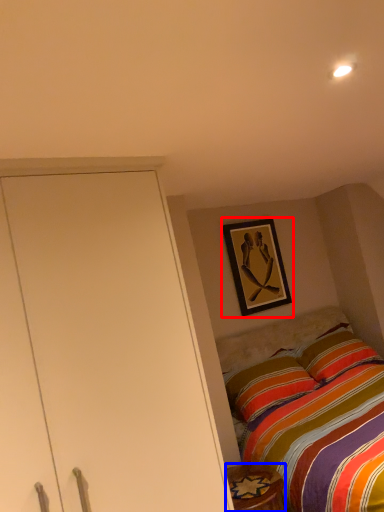
Question: Which point is further to the camera, picture frame (highlighted by a red box) or furniture (highlighted by a blue box)?

Choices:
 (A) picture frame
 (B) furniture

Answer: (A)